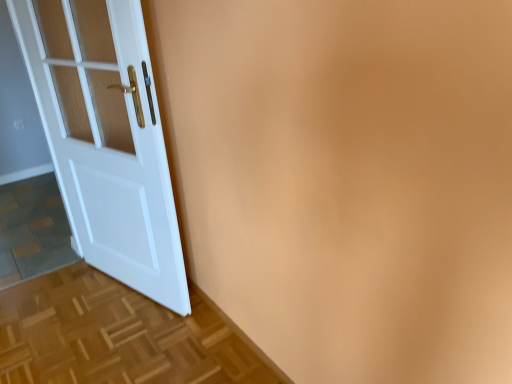
I want to click on white painted wood door at left, so click(106, 138).

What do you see at coordinates (106, 138) in the screenshot? This screenshot has height=384, width=512. I see `white painted wood door at left` at bounding box center [106, 138].

I want to click on white painted wood door at left, so click(106, 138).